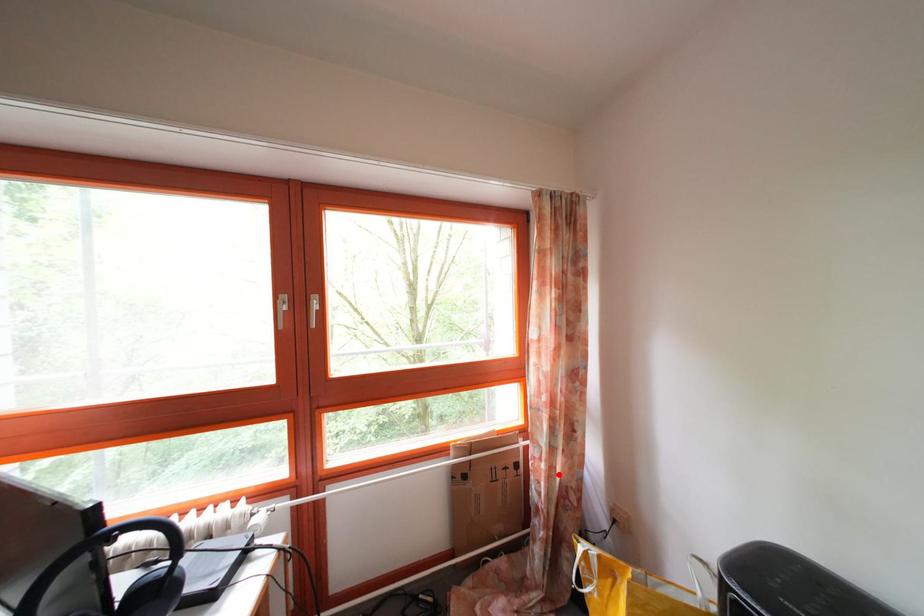
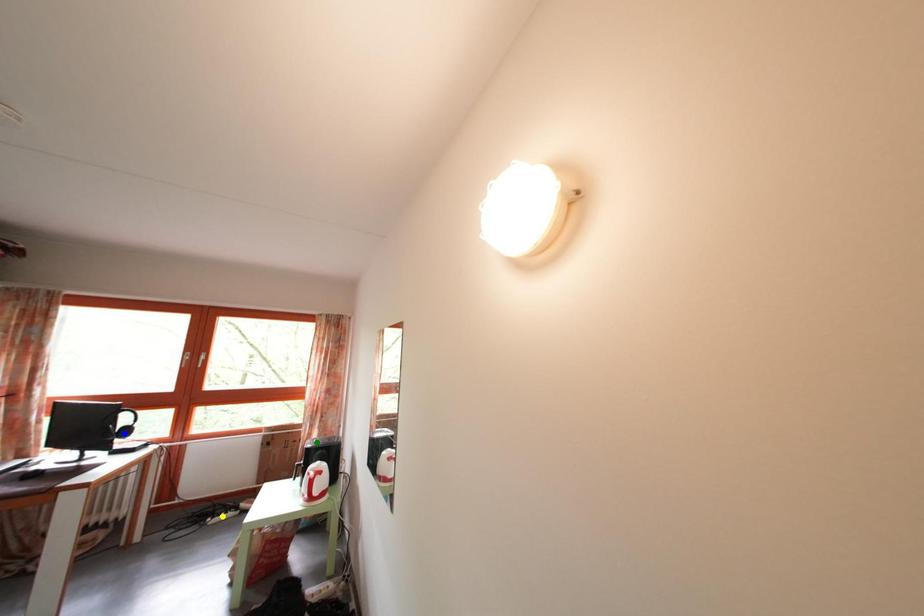
Question: I am providing you with two images of the same scene from different viewpoints. A red point is marked on the first image. You are given multiple points on the second image. Which spot in image 2 lines up with the point in image 1?

Choices:
 (A) blue point
 (B) yellow point
 (C) green point

Answer: (C)